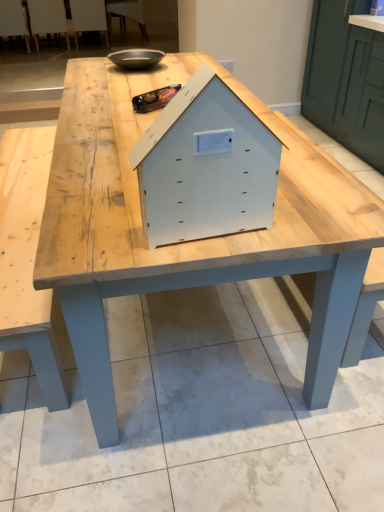
Question: Is white plastic chair at upper left, the second chair viewed from the right, not inside matte black bowl at upper center?

Choices:
 (A) no
 (B) yes

Answer: (B)

Question: Does white plastic chair at upper left, the second chair viewed from the right, lie in front of matte black bowl at upper center?

Choices:
 (A) yes
 (B) no

Answer: (B)

Question: Considering the relative sizes of white plastic chair at upper left, the second chair viewed from the right, and matte black bowl at upper center in the image provided, is white plastic chair at upper left, the second chair viewed from the right, taller than matte black bowl at upper center?

Choices:
 (A) yes
 (B) no

Answer: (A)

Question: Is white plastic chair at upper left, the second chair viewed from the right, positioned behind matte black bowl at upper center?

Choices:
 (A) no
 (B) yes

Answer: (B)

Question: Is white plastic chair at upper left, which is counted as the 3th chair, starting from the left, bigger than matte black bowl at upper center?

Choices:
 (A) yes
 (B) no

Answer: (A)

Question: Do you think matte black bowl at upper center is within wooden chair at upper left, the first chair positioned from the left, or outside of it?

Choices:
 (A) inside
 (B) outside

Answer: (B)

Question: Visually, is matte black bowl at upper center positioned to the left or to the right of wooden chair at upper left, the fourth chair in the right-to-left sequence?

Choices:
 (A) left
 (B) right

Answer: (B)

Question: In terms of size, does matte black bowl at upper center appear bigger or smaller than wooden chair at upper left, the fourth chair in the right-to-left sequence?

Choices:
 (A) big
 (B) small

Answer: (B)

Question: From the image's perspective, is matte black bowl at upper center positioned above or below wooden chair at upper left, the fourth chair in the right-to-left sequence?

Choices:
 (A) above
 (B) below

Answer: (B)

Question: Considering their positions, is white plastic chair at upper center, which ranks as the 1th chair in right-to-left order, located in front of or behind white matte wooden house at center?

Choices:
 (A) behind
 (B) front

Answer: (A)

Question: From the image's perspective, is white plastic chair at upper center, which ranks as the 1th chair in right-to-left order, positioned above or below white matte wooden house at center?

Choices:
 (A) below
 (B) above

Answer: (B)

Question: Considering the relative positions of white plastic chair at upper center, which ranks as the 1th chair in right-to-left order, and white matte wooden house at center in the image provided, is white plastic chair at upper center, which ranks as the 1th chair in right-to-left order, to the left or to the right of white matte wooden house at center?

Choices:
 (A) left
 (B) right

Answer: (A)

Question: Considering the positions of white plastic chair at upper center, which ranks as the 1th chair in right-to-left order, and white matte wooden house at center in the image, is white plastic chair at upper center, which ranks as the 1th chair in right-to-left order, wider or thinner than white matte wooden house at center?

Choices:
 (A) wide
 (B) thin

Answer: (A)

Question: From a real-world perspective, is white plastic chair at upper left, which is counted as the 3th chair, starting from the left, physically located above or below white matte wooden house at center?

Choices:
 (A) below
 (B) above

Answer: (A)

Question: In the image, is white plastic chair at upper left, the second chair viewed from the right, on the left side or the right side of white matte wooden house at center?

Choices:
 (A) left
 (B) right

Answer: (A)